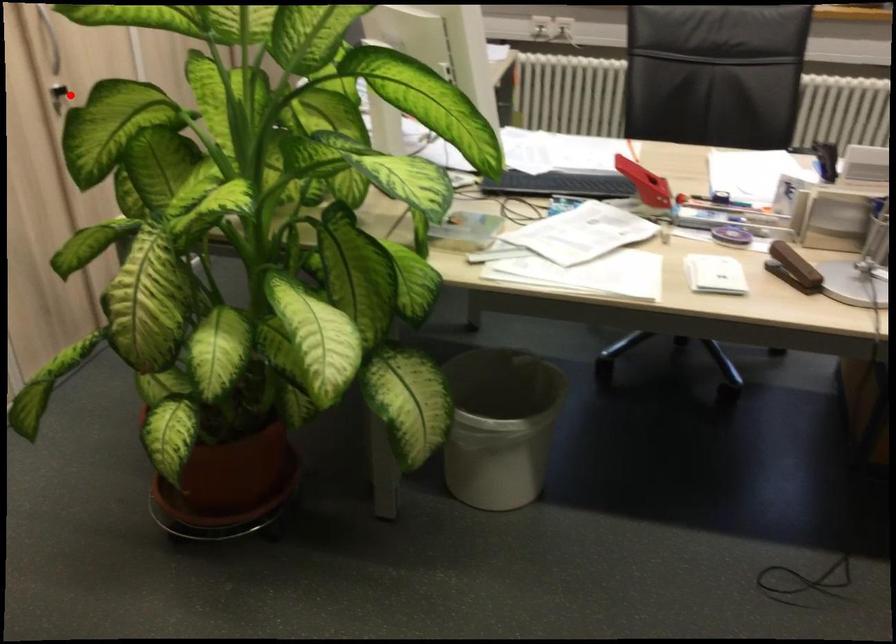
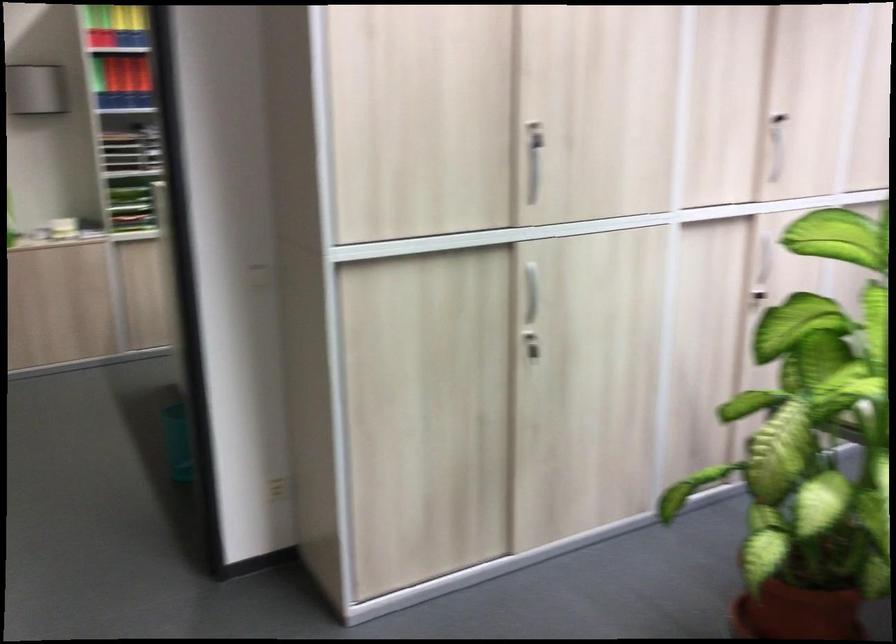
Question: I am providing you with two images of the same scene from different viewpoints. A red point is shown in image1. For the corresponding object point in image2, is it positioned nearer or farther from the camera?

Choices:
 (A) Nearer
 (B) Farther

Answer: (B)